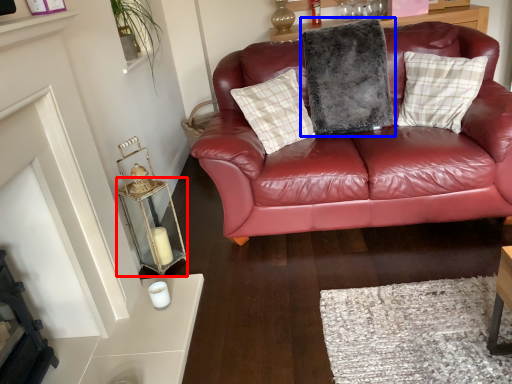
Question: Which object is closer to the camera taking this photo, table (highlighted by a red box) or pillow (highlighted by a blue box)?

Choices:
 (A) table
 (B) pillow

Answer: (A)